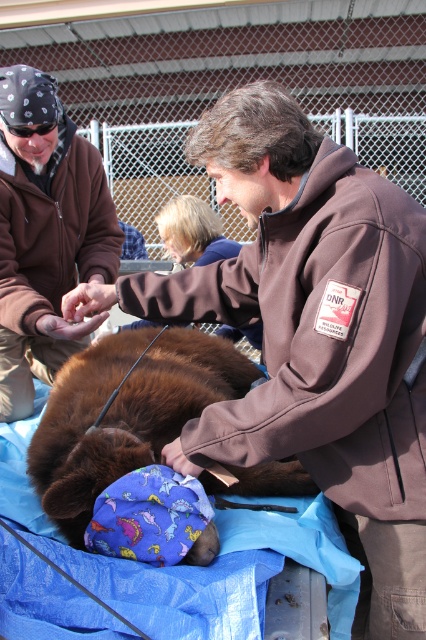
Question: Is brown furry bear at center to the left of black rubber goggles at upper left from the viewer's perspective?

Choices:
 (A) no
 (B) yes

Answer: (A)

Question: Is brown furry bear at center thinner than black rubber goggles at upper left?

Choices:
 (A) yes
 (B) no

Answer: (B)

Question: Which of the following is the closest to the observer?

Choices:
 (A) (46, 108)
 (B) (55, 125)

Answer: (A)

Question: Among these objects, which one is farthest from the camera?

Choices:
 (A) brown suede jacket at upper left
 (B) black rubber goggles at upper left

Answer: (B)

Question: Which object is closer to the camera taking this photo?

Choices:
 (A) brown suede jacket at upper left
 (B) black rubber goggles at upper left

Answer: (A)

Question: Does brown furry bear at center have a lesser width compared to black rubber goggles at upper left?

Choices:
 (A) no
 (B) yes

Answer: (A)